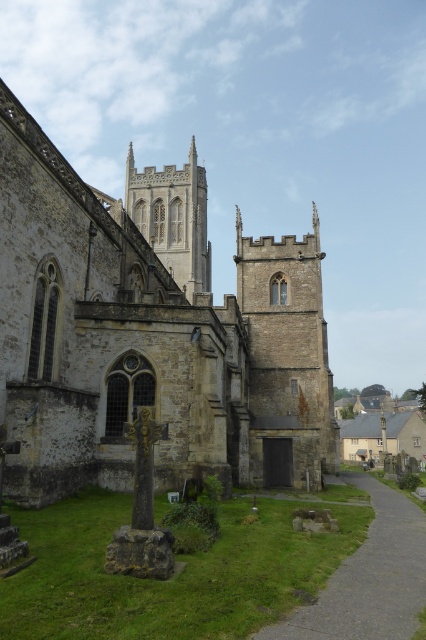
Question: Does stone church at center have a lesser width compared to stone spire at center?

Choices:
 (A) no
 (B) yes

Answer: (A)

Question: Which object appears farthest from the camera in this image?

Choices:
 (A) brown gravel path at lower center
 (B) stone church at center
 (C) stone spire at center

Answer: (C)

Question: Which point is farther from the camera taking this photo?

Choices:
 (A) (230, 465)
 (B) (192, 248)
 (C) (402, 502)

Answer: (B)

Question: Is brown gravel path at lower center closer to the viewer compared to stone spire at center?

Choices:
 (A) yes
 (B) no

Answer: (A)

Question: Is stone church at center above brown gravel path at lower center?

Choices:
 (A) yes
 (B) no

Answer: (A)

Question: Considering the real-world distances, which object is closest to the brown gravel path at lower center?

Choices:
 (A) stone church at center
 (B) stone spire at center

Answer: (A)